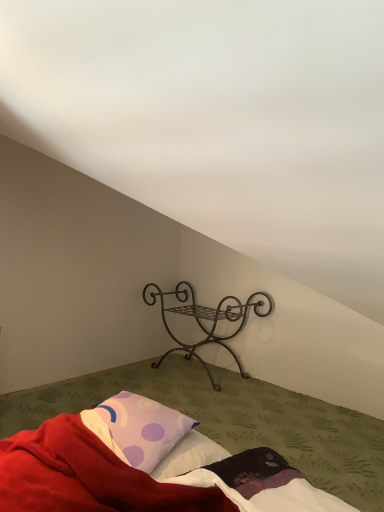
What do you see at coordinates (208, 320) in the screenshot? The width and height of the screenshot is (384, 512). I see `dark brown wrought iron stand at center` at bounding box center [208, 320].

Find the location of a particular element. soft cotton bed at center is located at coordinates (144, 467).

Locate an element on the screen. dark brown wrought iron stand at center is located at coordinates (208, 320).

From a real-world perspective, is dark brown wrought iron stand at center below purple dotted pillow at lower left?

Correct, in the physical world, dark brown wrought iron stand at center is lower than purple dotted pillow at lower left.

Consider the image. Considering the relative sizes of dark brown wrought iron stand at center and purple dotted pillow at lower left in the image provided, is dark brown wrought iron stand at center taller than purple dotted pillow at lower left?

Correct, dark brown wrought iron stand at center is much taller as purple dotted pillow at lower left.

Is dark brown wrought iron stand at center oriented away from purple dotted pillow at lower left?

No, dark brown wrought iron stand at center is not facing the opposite direction of purple dotted pillow at lower left.

Considering the sizes of objects dark brown wrought iron stand at center and purple dotted pillow at lower left in the image provided, who is bigger, dark brown wrought iron stand at center or purple dotted pillow at lower left?

dark brown wrought iron stand at center is bigger.

Who is shorter, purple dotted pillow at lower left or dark brown wrought iron stand at center?

Standing shorter between the two is purple dotted pillow at lower left.

Is purple dotted pillow at lower left beside dark brown wrought iron stand at center?

No, purple dotted pillow at lower left is not touching dark brown wrought iron stand at center.

Considering the relative sizes of purple dotted pillow at lower left and dark brown wrought iron stand at center in the image provided, is purple dotted pillow at lower left wider than dark brown wrought iron stand at center?

No.

Identify the location of furniture located underneath the purple dotted pillow at lower left (from a real-world perspective). Image resolution: width=384 pixels, height=512 pixels. (208, 320).

Is dark brown wrought iron stand at center thinner than soft cotton bed at center?

Yes, dark brown wrought iron stand at center is thinner than soft cotton bed at center.

Considering the points (180, 291) and (51, 426), which point is behind, point (180, 291) or point (51, 426)?

Positioned behind is point (180, 291).

I want to click on furniture that appears on the right of soft cotton bed at center, so click(x=208, y=320).

Who is shorter, dark brown wrought iron stand at center or soft cotton bed at center?

soft cotton bed at center is shorter.

Looking at this image, considering the sizes of objects soft cotton bed at center and dark brown wrought iron stand at center in the image provided, who is bigger, soft cotton bed at center or dark brown wrought iron stand at center?

Bigger between the two is soft cotton bed at center.

From a real-world perspective, which is physically above, soft cotton bed at center or dark brown wrought iron stand at center?

dark brown wrought iron stand at center is physically above.

Considering the relative positions of soft cotton bed at center and dark brown wrought iron stand at center in the image provided, is soft cotton bed at center to the left of dark brown wrought iron stand at center from the viewer's perspective?

Yes, soft cotton bed at center is to the left of dark brown wrought iron stand at center.

How different are the orientations of soft cotton bed at center and dark brown wrought iron stand at center in degrees?

They differ by 0.0522 degrees in their facing directions.

From a real-world perspective, who is located higher, soft cotton bed at center or purple dotted pillow at lower left?

From a 3D spatial view, purple dotted pillow at lower left is above.

From the picture: Is the depth of soft cotton bed at center less than that of purple dotted pillow at lower left?

Yes, it is in front of purple dotted pillow at lower left.

The height and width of the screenshot is (512, 384). What are the coordinates of `bed below the purple dotted pillow at lower left (from a real-world perspective)` in the screenshot? It's located at (144, 467).

Would you say purple dotted pillow at lower left is a long distance from soft cotton bed at center?

No, purple dotted pillow at lower left is in close proximity to soft cotton bed at center.

From a real-world perspective, between purple dotted pillow at lower left and soft cotton bed at center, who is vertically lower?

soft cotton bed at center is physically lower.

Can you tell me how much purple dotted pillow at lower left and soft cotton bed at center differ in facing direction?

The angle between the facing direction of purple dotted pillow at lower left and the facing direction of soft cotton bed at center is 88.9 degrees.

Is the depth of purple dotted pillow at lower left greater than that of soft cotton bed at center?

Yes, the depth of purple dotted pillow at lower left is greater than that of soft cotton bed at center.

At what (x,y) coordinates should I click in order to perform the action: click on pillow located above the dark brown wrought iron stand at center (from a real-world perspective). Please return your answer as a coordinate pair (x, y). Looking at the image, I should click on (138, 428).

The image size is (384, 512). What are the coordinates of `pillow in front of the dark brown wrought iron stand at center` in the screenshot? It's located at (138, 428).

Looking at the image, which one is located closer to purple dotted pillow at lower left, dark brown wrought iron stand at center or soft cotton bed at center?

soft cotton bed at center lies closer to purple dotted pillow at lower left than the other object.

Estimate the real-world distances between objects in this image. Which object is further from dark brown wrought iron stand at center, purple dotted pillow at lower left or soft cotton bed at center?

The object further to dark brown wrought iron stand at center is soft cotton bed at center.

Which object lies further to the anchor point purple dotted pillow at lower left, soft cotton bed at center or dark brown wrought iron stand at center?

The object further to purple dotted pillow at lower left is dark brown wrought iron stand at center.

Estimate the real-world distances between objects in this image. Which object is further from soft cotton bed at center, dark brown wrought iron stand at center or purple dotted pillow at lower left?

dark brown wrought iron stand at center lies further to soft cotton bed at center than the other object.

Considering their positions, is soft cotton bed at center positioned further to dark brown wrought iron stand at center than purple dotted pillow at lower left?

Based on the image, soft cotton bed at center appears to be further to dark brown wrought iron stand at center.

Considering their positions, is purple dotted pillow at lower left positioned further to soft cotton bed at center than dark brown wrought iron stand at center?

dark brown wrought iron stand at center.

Locate an element on the screen. This screenshot has width=384, height=512. pillow between soft cotton bed at center and dark brown wrought iron stand at center from front to back is located at coordinates (138, 428).